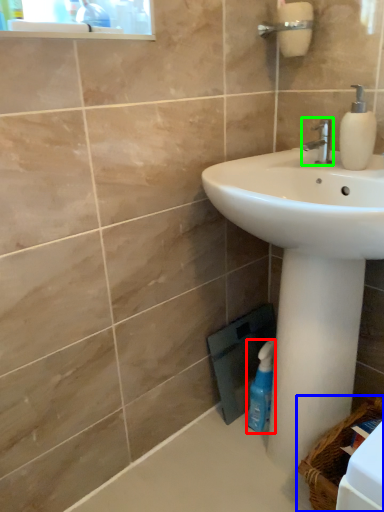
Question: Which object is the farthest from cleaning product (highlighted by a red box)? Choose among these: basket (highlighted by a blue box) or tap (highlighted by a green box).

Choices:
 (A) basket
 (B) tap

Answer: (B)